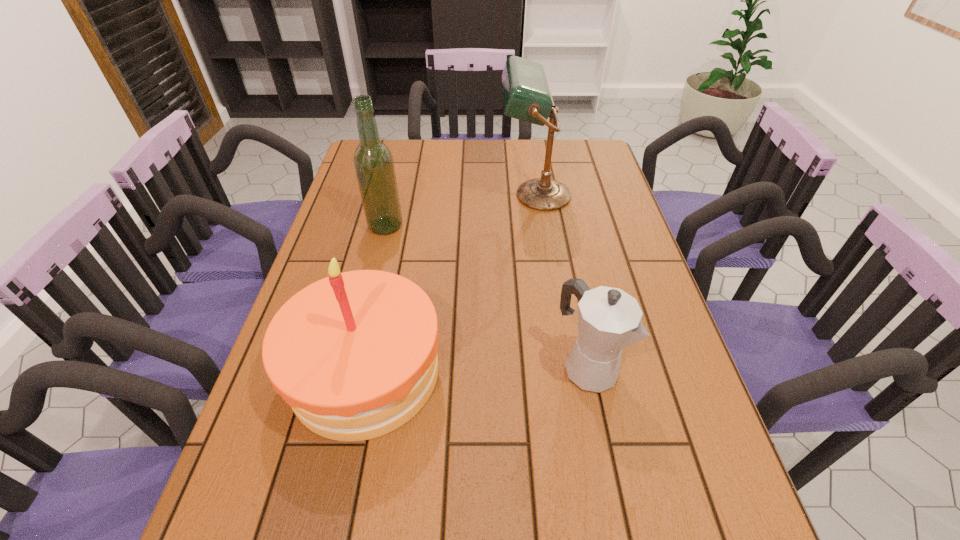
This screenshot has height=540, width=960. Find the location of `object located in the far edge section of the desktop`. object located in the far edge section of the desktop is located at coordinates (526, 96).

The height and width of the screenshot is (540, 960). Identify the location of liquor at the left edge. (374, 166).

You are a GUI agent. You are given a task and a screenshot of the screen. Output one action in this format:
    pyautogui.click(x=<x>, y=<y>)
    Task: Click on the birthday cake that is positioned at the left edge
    The height and width of the screenshot is (540, 960).
    Given the screenshot: What is the action you would take?
    pyautogui.click(x=354, y=354)

Find the location of a particular element. table lamp that is positioned at the right edge is located at coordinates (526, 96).

Identify the location of coffeepot that is positioned at the right edge. (609, 319).

Where is `object at the far right corner`? This screenshot has height=540, width=960. object at the far right corner is located at coordinates pos(526,96).

The image size is (960, 540). I want to click on vacant point at the far edge, so click(x=552, y=166).

The image size is (960, 540). In order to click on free region at the left edge of the desktop in this screenshot , I will do `click(276, 424)`.

In the image, there is a desktop. Where is `free space at the right edge`? free space at the right edge is located at coordinates click(687, 522).

Identify the location of free space at the far right corner. (587, 160).